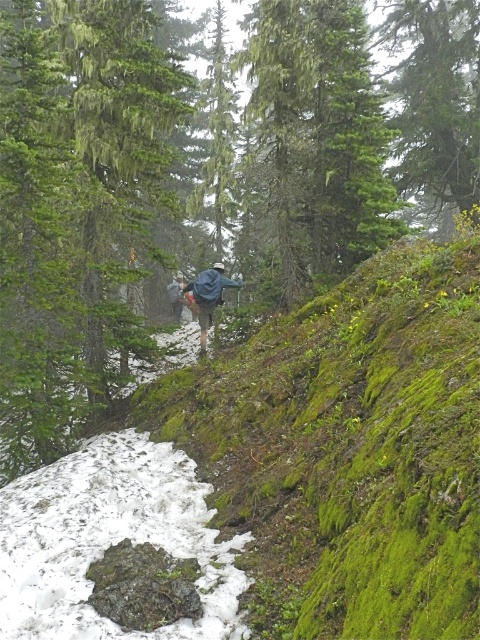
Question: Does white powdery snow at lower left have a smaller size compared to blue fabric backpack at center?

Choices:
 (A) no
 (B) yes

Answer: (A)

Question: Does white powdery snow at lower left have a smaller size compared to blue denim jacket at center?

Choices:
 (A) no
 (B) yes

Answer: (A)

Question: Which point is farther to the camera?

Choices:
 (A) (178, 292)
 (B) (36, 529)
 (C) (216, 282)

Answer: (A)

Question: Among these points, which one is nearest to the camera?

Choices:
 (A) (218, 266)
 (B) (168, 296)
 (C) (123, 464)

Answer: (C)

Question: Estimate the real-world distances between objects in this image. Which object is closer to the blue fabric backpack at center?

Choices:
 (A) blue denim jacket at center
 (B) white powdery snow at lower left

Answer: (B)

Question: Can you confirm if blue fabric backpack at center is wider than blue denim jacket at center?

Choices:
 (A) yes
 (B) no

Answer: (A)